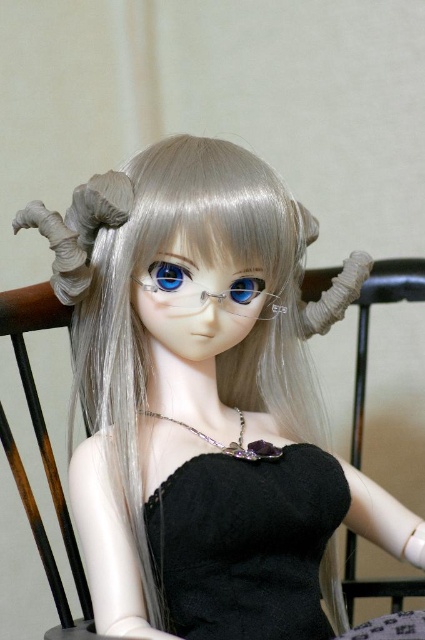
You are standing in front of the doll and want to touch one of the two points on its body. The first point is at coordinates point (180,280) and the second is at point (251,280). Which point would require you to reach further forward to touch?

Point (251,280) would require reaching further forward because it is farther from the viewer compared to point (180,280).

You are a photographer trying to capture the doll in the image. You notice two points marked on the doll. Which point, point (x=223, y=564) or point (x=251, y=280), is closer to you?

Point (x=223, y=564) is closer to the viewer than point (x=251, y=280).